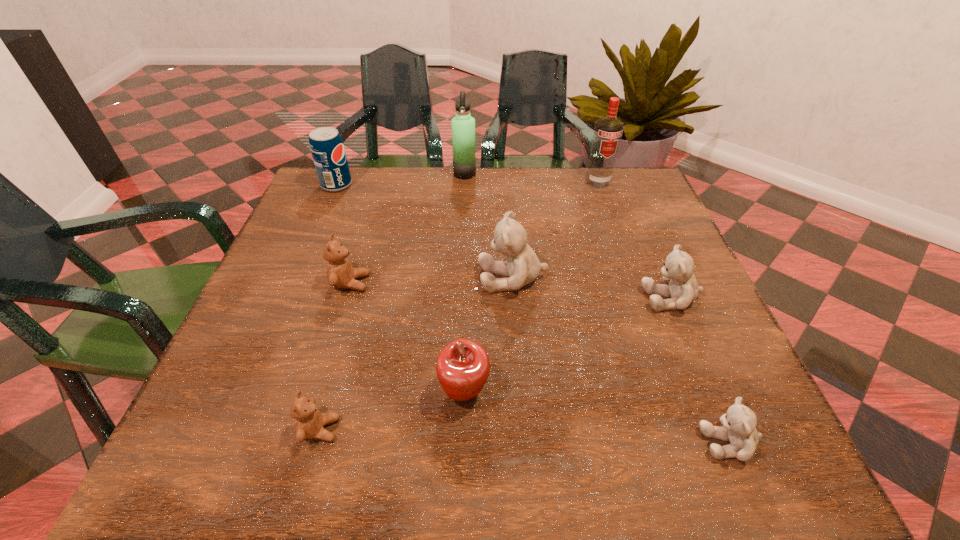
Find the location of `the nearest gray teddy bear`. the nearest gray teddy bear is located at coordinates (738, 427).

Image resolution: width=960 pixels, height=540 pixels. In order to click on blank area located on the left of the thermos bottle in this screenshot , I will do 367,174.

This screenshot has width=960, height=540. Identify the location of free space located on the front label of the vodka. (623, 254).

You are a GUI agent. You are given a task and a screenshot of the screen. Output one action in this format:
    pyautogui.click(x=<x>, y=<y>)
    Task: Click on the free location located 0.050m on the front of the pop
    The image size is (960, 540).
    Given the screenshot: What is the action you would take?
    pyautogui.click(x=328, y=204)

Where is `vacant point located 0.330m on the face of the tallest teddy bear`? This screenshot has height=540, width=960. vacant point located 0.330m on the face of the tallest teddy bear is located at coordinates (326, 278).

Locate an element on the screen. vacant area situated on the face of the tallest teddy bear is located at coordinates (400, 278).

At what (x,y) coordinates should I click in order to perform the action: click on vacant space located on the face of the tallest teddy bear. Please return your answer as a coordinate pair (x, y). Image resolution: width=960 pixels, height=540 pixels. Looking at the image, I should click on click(414, 278).

Where is `free location located 0.370m on the face of the farther brown teddy bear`? Image resolution: width=960 pixels, height=540 pixels. free location located 0.370m on the face of the farther brown teddy bear is located at coordinates (541, 283).

Identify the location of vacant region located on the face of the second biggest gray teddy bear. The image size is (960, 540). (521, 299).

At what (x,y) coordinates should I click in order to perform the action: click on vacant space located 0.260m on the face of the second biggest gray teddy bear. Please return your answer as a coordinate pair (x, y). This screenshot has height=540, width=960. Looking at the image, I should click on (516, 299).